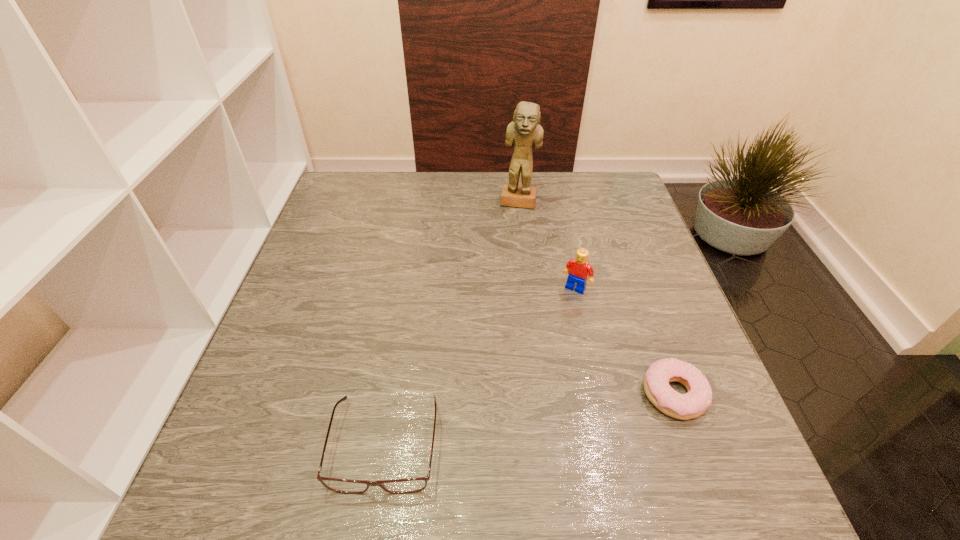
Locate an element on the screen. This screenshot has height=540, width=960. free space between the tallest object and the third nearest object is located at coordinates (547, 245).

Locate an element on the screen. This screenshot has height=540, width=960. free space between the third shortest object and the figurine is located at coordinates (547, 245).

Find the location of a particular element. empty space that is in between the second object from left to right and the Lego is located at coordinates (547, 245).

Locate an element on the screen. The image size is (960, 540). free spot between the third object from right to left and the spectacles is located at coordinates (452, 323).

Locate an element on the screen. Image resolution: width=960 pixels, height=540 pixels. object that is the third closest to the leftmost object is located at coordinates (525, 131).

Where is `object that can be found as the closest to the second object from left to right`? Image resolution: width=960 pixels, height=540 pixels. object that can be found as the closest to the second object from left to right is located at coordinates (578, 269).

Where is `free location that satisfies the following two spatial constraints: 1. on the front side of the tallest object; 2. on the right side of the third shortest object`? free location that satisfies the following two spatial constraints: 1. on the front side of the tallest object; 2. on the right side of the third shortest object is located at coordinates (528, 288).

This screenshot has height=540, width=960. I want to click on free region that satisfies the following two spatial constraints: 1. on the front side of the figurine; 2. on the left side of the rightmost object, so click(540, 394).

This screenshot has height=540, width=960. What are the coordinates of `vacant region that satisfies the following two spatial constraints: 1. on the front side of the rightmost object; 2. on the right side of the Lego` in the screenshot? It's located at (599, 394).

Locate an element on the screen. vacant area that satisfies the following two spatial constraints: 1. on the front side of the rightmost object; 2. on the left side of the tallest object is located at coordinates (540, 394).